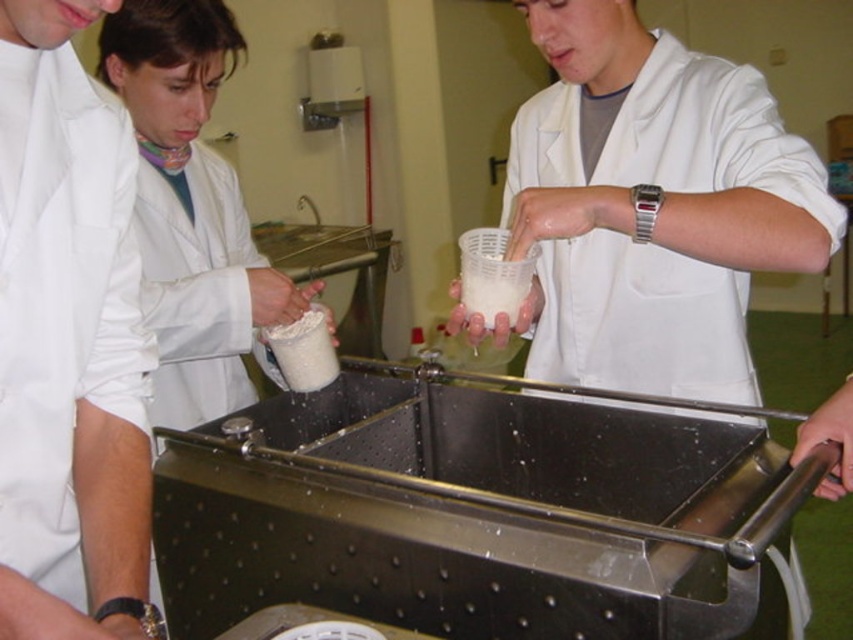
Question: Is white matte plastic cup at center positioned behind white matte lab coat at left?

Choices:
 (A) no
 (B) yes

Answer: (B)

Question: Which point is closer to the camera taking this photo?

Choices:
 (A) (12, 484)
 (B) (718, 300)

Answer: (A)

Question: Does white matte plastic cup at center have a smaller size compared to white matte lab coat at left?

Choices:
 (A) yes
 (B) no

Answer: (B)

Question: Does white matte plastic cup at center appear on the right side of white matte lab coat at left?

Choices:
 (A) yes
 (B) no

Answer: (A)

Question: Among these objects, which one is nearest to the camera?

Choices:
 (A) white matte lab coat at left
 (B) white matte plastic cup at center

Answer: (A)

Question: Among these objects, which one is nearest to the camera?

Choices:
 (A) white matte plastic cup at center
 (B) white matte lab coat at left

Answer: (B)